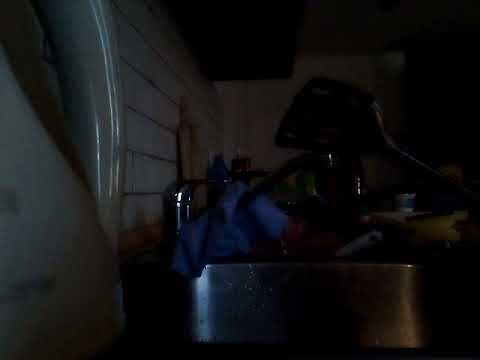
At what (x,y) coordinates should I click in order to perform the action: click on handle. Please return your answer as a coordinate pair (x, y). Looking at the image, I should click on (181, 188).